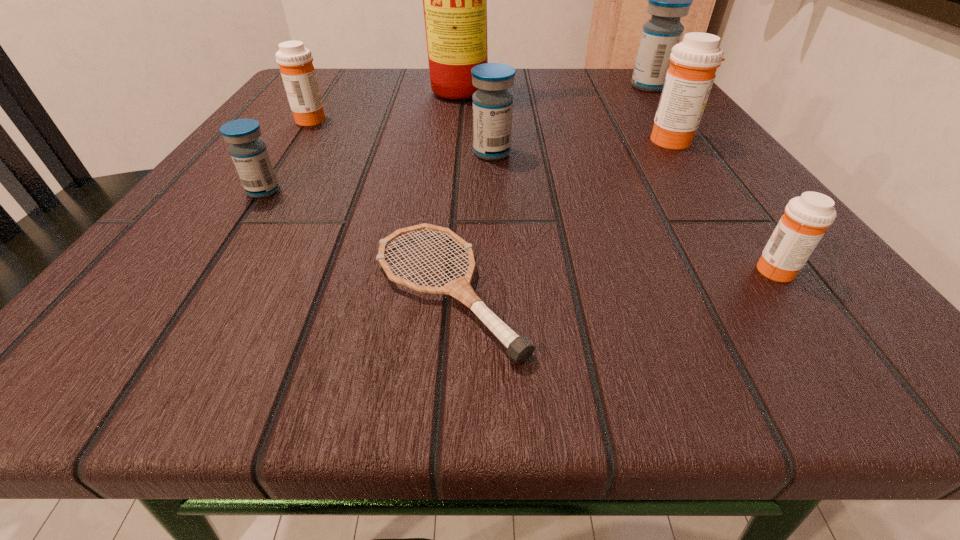
Locate an element on the screen. Image resolution: width=960 pixels, height=540 pixels. orange medicine object that ranks as the closest to the smallest orange medicine is located at coordinates (689, 79).

Where is `free space that satisfies the following two spatial constraints: 1. on the front-facing side of the nearest medicine; 2. on the right side of the tallest object`? free space that satisfies the following two spatial constraints: 1. on the front-facing side of the nearest medicine; 2. on the right side of the tallest object is located at coordinates (461, 269).

Locate an element on the screen. The width and height of the screenshot is (960, 540). vacant region that satisfies the following two spatial constraints: 1. on the front side of the smallest orange medicine; 2. on the right side of the second biggest orange medicine is located at coordinates (209, 269).

At what (x,y) coordinates should I click in order to perform the action: click on free space in the image that satisfies the following two spatial constraints: 1. on the front-facing side of the fire extinguisher; 2. on the left side of the second farthest orange medicine. Please return your answer as a coordinate pair (x, y). This screenshot has height=540, width=960. Looking at the image, I should click on (467, 140).

Locate an element on the screen. free location that satisfies the following two spatial constraints: 1. on the front-facing side of the red fire extinguisher; 2. on the left side of the second blue medicine from left to right is located at coordinates (467, 153).